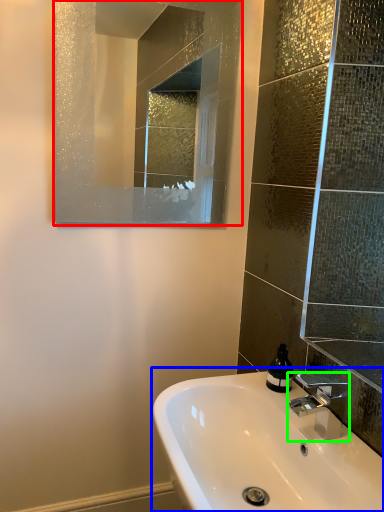
Question: Which object is the farthest from mirror (highlighted by a red box)? Choose among these: sink (highlighted by a blue box) or tap (highlighted by a green box).

Choices:
 (A) sink
 (B) tap

Answer: (B)